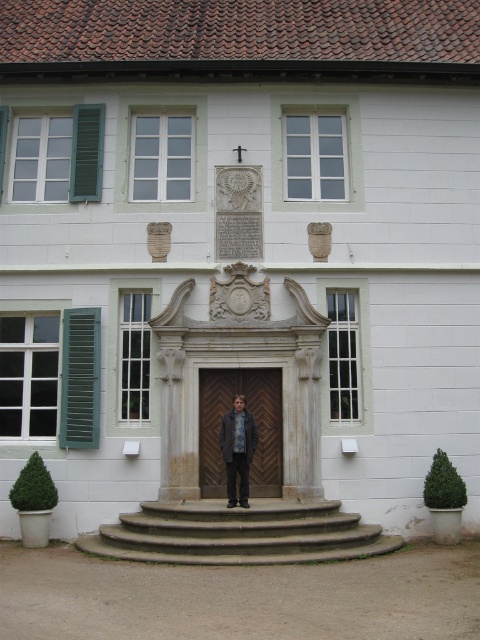
Measure the distance between green wooden shutter at left and denim jacket at center.

The distance of green wooden shutter at left from denim jacket at center is 8.60 feet.

Who is more distant from viewer, (92, 419) or (240, 433)?

The point (92, 419) is more distant.

This screenshot has width=480, height=640. What are the coordinates of `green wooden shutter at left` in the screenshot? It's located at (81, 378).

Is smooth concrete stairs at center below green wooden shutter at left?

Indeed, smooth concrete stairs at center is positioned under green wooden shutter at left.

Can you confirm if smooth concrete stairs at center is wider than green wooden shutter at left?

Correct, the width of smooth concrete stairs at center exceeds that of green wooden shutter at left.

Does point (296, 554) lie behind point (97, 394)?

No.

Where is `smooth concrete stairs at center`? The width and height of the screenshot is (480, 640). smooth concrete stairs at center is located at coordinates (239, 532).

Can you confirm if wooden door at center is positioned to the right of green painted wood shutter at left?

Yes, wooden door at center is to the right of green painted wood shutter at left.

Which is in front, point (242, 380) or point (91, 179)?

Point (242, 380) is in front.

What are the coordinates of `wooden door at center` in the screenshot? It's located at (255, 420).

Identify the location of wooden door at center. (255, 420).